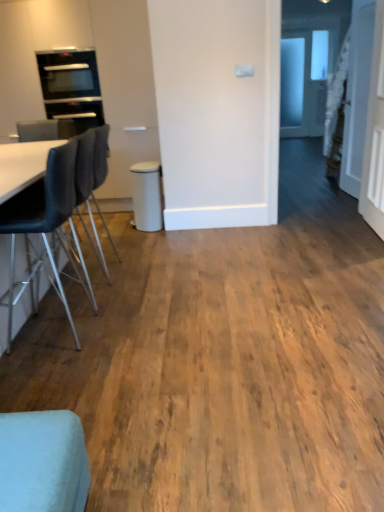
Find the location of `black glass oven at upper left`. black glass oven at upper left is located at coordinates (71, 88).

The height and width of the screenshot is (512, 384). I want to click on light blue fabric chair at lower left, marked as the first chair in a front-to-back arrangement, so click(x=43, y=462).

Describe the element at coordinates (92, 181) in the screenshot. Image resolution: width=384 pixels, height=512 pixels. I see `black leather chair at left, the 3th chair in the front-to-back sequence` at that location.

Where is `black leather chair at left, which is the second chair from back to front`? Image resolution: width=384 pixels, height=512 pixels. black leather chair at left, which is the second chair from back to front is located at coordinates (45, 227).

From the image's perspective, is black glass oven at upper left located beneath light blue fabric chair at lower left, marked as the first chair in a front-to-back arrangement?

No, from the image's perspective, black glass oven at upper left is not beneath light blue fabric chair at lower left, marked as the first chair in a front-to-back arrangement.

Is black glass oven at upper left further to the viewer compared to light blue fabric chair at lower left, marked as the first chair in a front-to-back arrangement?

Yes, black glass oven at upper left is further from the camera.

Choose the correct answer: Is black glass oven at upper left inside light blue fabric chair at lower left, which ranks as the third chair in back-to-front order, or outside it?

The correct answer is: outside.

Which object is thinner, black glass oven at upper left or light blue fabric chair at lower left, marked as the first chair in a front-to-back arrangement?

light blue fabric chair at lower left, marked as the first chair in a front-to-back arrangement, is thinner.

From the image's perspective, which object appears higher, black leather chair at left, the first chair from the back, or black leather chair at left, which is the second chair from back to front?

black leather chair at left, the first chair from the back, appears higher in the image.

Is point (84, 137) less distant than point (69, 310)?

Yes.

Considering the sizes of objects black leather chair at left, the 3th chair in the front-to-back sequence, and black leather chair at left, the 2th chair from the front, in the image provided, who is thinner, black leather chair at left, the 3th chair in the front-to-back sequence, or black leather chair at left, the 2th chair from the front,?

Thinner between the two is black leather chair at left, the 3th chair in the front-to-back sequence.

Is the surface of black leather chair at left, the 3th chair in the front-to-back sequence, in direct contact with black leather chair at left, which is the second chair from back to front?

No, black leather chair at left, the 3th chair in the front-to-back sequence, is not beside black leather chair at left, which is the second chair from back to front.

Which is nearer, (345, 154) or (2, 204)?

Point (345, 154) appears to be farther away from the viewer than point (2, 204).

Is white glossy door at upper right directly adjacent to black leather chair at left, the 2th chair from the front?

white glossy door at upper right and black leather chair at left, the 2th chair from the front, are not in contact.

Based on the photo, is white glossy door at upper right turned away from black leather chair at left, which is the second chair from back to front?

No, black leather chair at left, which is the second chair from back to front, is not at the back of white glossy door at upper right.

Between point (11, 319) and point (361, 124), which one is positioned behind?

The point (361, 124) is behind.

Which object is thinner, black leather chair at left, the 2th chair from the front, or white glossy door at upper right?

Thinner between the two is white glossy door at upper right.

Can you tell me how much black leather chair at left, which is the second chair from back to front, and white glossy door at upper right differ in facing direction?

There is a 4.56-degree angle between the facing directions of black leather chair at left, which is the second chair from back to front, and white glossy door at upper right.

Is black leather chair at left, the 2th chair from the front, next to white glossy door at upper right and touching it?

black leather chair at left, the 2th chair from the front, and white glossy door at upper right are clearly separated.

I want to click on bar stool above the black leather chair at left, the 3th chair in the front-to-back sequence (from the image's perspective), so pos(147,196).

Which object is wider, matte white bar stool at center or black leather chair at left, the first chair from the back?

With larger width is black leather chair at left, the first chair from the back.

Is matte white bar stool at center beside black leather chair at left, the 3th chair in the front-to-back sequence?

There is a gap between matte white bar stool at center and black leather chair at left, the 3th chair in the front-to-back sequence.

In the scene shown: Which of these two, white glossy door at upper right or black leather chair at left, the first chair from the back, is wider?

black leather chair at left, the first chair from the back, is wider.

Could you measure the distance between white glossy door at upper right and black leather chair at left, the 3th chair in the front-to-back sequence?

A distance of 8.24 feet exists between white glossy door at upper right and black leather chair at left, the 3th chair in the front-to-back sequence.

Which is closer, (373,1) or (98,180)?

Clearly, point (373,1) is more distant from the camera than point (98,180).

From the picture: Could you tell me if white glossy door at upper right is facing black leather chair at left, the first chair from the back?

No, white glossy door at upper right does not turn towards black leather chair at left, the first chair from the back.

Looking at the image, does light blue fabric chair at lower left, which ranks as the third chair in back-to-front order, seem bigger or smaller compared to black leather chair at left, the 2th chair from the front?

In the image, light blue fabric chair at lower left, which ranks as the third chair in back-to-front order, appears to be smaller than black leather chair at left, the 2th chair from the front.

Based on the photo, is the depth of light blue fabric chair at lower left, marked as the first chair in a front-to-back arrangement, greater than that of black leather chair at left, which is the second chair from back to front?

That is False.

Which chair is the 2nd one when counting from the right side of the black leather chair at left, which is the second chair from back to front? Please provide its 2D coordinates.

[(43, 462)]

I want to click on the 3rd chair below the black glass oven at upper left (from a real-world perspective), so click(x=43, y=462).

The height and width of the screenshot is (512, 384). In order to click on chair lying on the left of black leather chair at left, the first chair from the back in this screenshot , I will do `click(45, 227)`.

Estimate the real-world distances between objects in this image. Which object is further from matte white bar stool at center, white glossy door at upper right or black glass oven at upper left?

white glossy door at upper right is further to matte white bar stool at center.

Based on their spatial positions, is white glossy door at upper right or black leather chair at left, the 3th chair in the front-to-back sequence, closer to black leather chair at left, which is the second chair from back to front?

The object closer to black leather chair at left, which is the second chair from back to front, is black leather chair at left, the 3th chair in the front-to-back sequence.

Based on their spatial positions, is matte white bar stool at center or light blue fabric chair at lower left, which ranks as the third chair in back-to-front order, further from black leather chair at left, the 3th chair in the front-to-back sequence?

The object further to black leather chair at left, the 3th chair in the front-to-back sequence, is light blue fabric chair at lower left, which ranks as the third chair in back-to-front order.

Looking at the image, which one is located further to black leather chair at left, which is the second chair from back to front, white glossy door at upper right or matte white bar stool at center?

white glossy door at upper right is further to black leather chair at left, which is the second chair from back to front.

Considering their positions, is light blue fabric chair at lower left, which ranks as the third chair in back-to-front order, positioned closer to black leather chair at left, which is the second chair from back to front, than black glass oven at upper left?

Based on the image, light blue fabric chair at lower left, which ranks as the third chair in back-to-front order, appears to be nearer to black leather chair at left, which is the second chair from back to front.

Looking at the image, which one is located further to black leather chair at left, the first chair from the back, matte white bar stool at center or black glass oven at upper left?

The object further to black leather chair at left, the first chair from the back, is black glass oven at upper left.

Looking at the image, which one is located further to black leather chair at left, the 2th chair from the front, black leather chair at left, the 3th chair in the front-to-back sequence, or black glass oven at upper left?

Based on the image, black glass oven at upper left appears to be further to black leather chair at left, the 2th chair from the front.

From the image, which object appears to be farther from black glass oven at upper left, black leather chair at left, which is the second chair from back to front, or white glossy door at upper right?

The object further to black glass oven at upper left is white glossy door at upper right.

Where is `bar stool located between light blue fabric chair at lower left, which ranks as the third chair in back-to-front order, and black glass oven at upper left in the depth direction`? The image size is (384, 512). bar stool located between light blue fabric chair at lower left, which ranks as the third chair in back-to-front order, and black glass oven at upper left in the depth direction is located at coordinates (147, 196).

You are a GUI agent. You are given a task and a screenshot of the screen. Output one action in this format:
    pyautogui.click(x=<x>, y=<y>)
    Task: Click on the bar stool located between black leather chair at left, the 3th chair in the front-to-back sequence, and white glossy door at upper right in the left-right direction
    The width and height of the screenshot is (384, 512).
    Given the screenshot: What is the action you would take?
    pyautogui.click(x=147, y=196)

Where is `chair between black leather chair at left, the 2th chair from the front, and matte white bar stool at center in the front-back direction`? chair between black leather chair at left, the 2th chair from the front, and matte white bar stool at center in the front-back direction is located at coordinates (92, 181).

This screenshot has height=512, width=384. I want to click on bar stool between black leather chair at left, the 2th chair from the front, and white glossy door at upper right, so click(x=147, y=196).